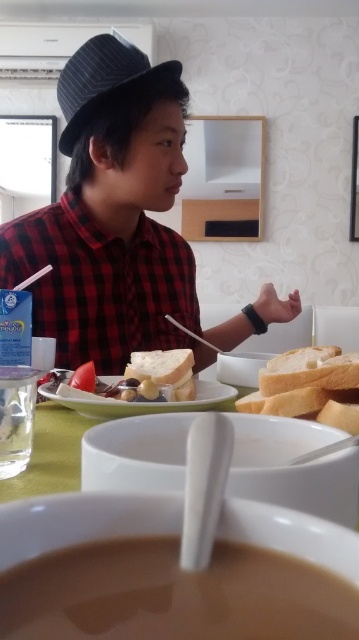
Question: Which object is closer to the camera taking this photo?

Choices:
 (A) matte black hat at upper left
 (B) white matte plate at center

Answer: (B)

Question: Which object appears closest to the camera in this image?

Choices:
 (A) red checkered shirt at left
 (B) white matte plate at center
 (C) white matte bread at center
 (D) matte black hat at upper left

Answer: (C)

Question: Among these objects, which one is nearest to the camera?

Choices:
 (A) white matte plate at center
 (B) matte black hat at upper left
 (C) green matte table at center

Answer: (C)

Question: Does green matte table at center have a larger size compared to brown matte soup at lower center?

Choices:
 (A) yes
 (B) no

Answer: (A)

Question: Does green matte table at center come in front of red checkered shirt at left?

Choices:
 (A) no
 (B) yes

Answer: (B)

Question: Does green matte table at center appear over brown matte soup at lower center?

Choices:
 (A) yes
 (B) no

Answer: (A)